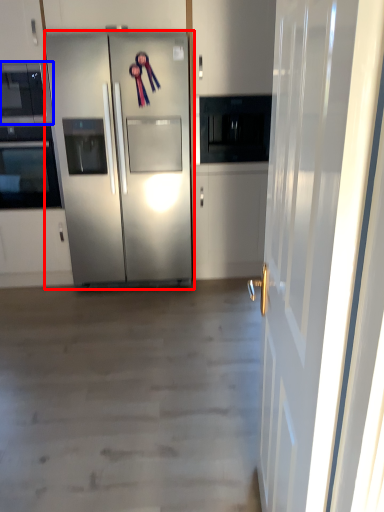
Question: Among these objects, which one is farthest to the camera, refrigerator (highlighted by a red box) or microwave oven (highlighted by a blue box)?

Choices:
 (A) refrigerator
 (B) microwave oven

Answer: (B)